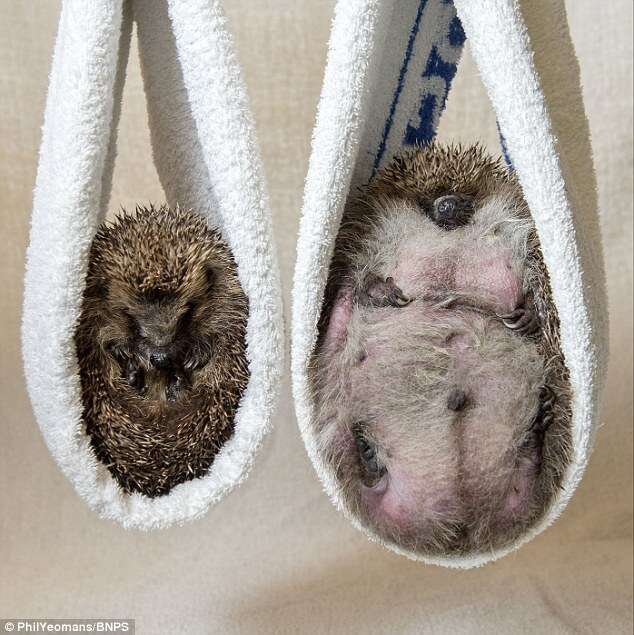
The image size is (634, 635). Identify the location of empty space between towels. (136, 159), (458, 117).